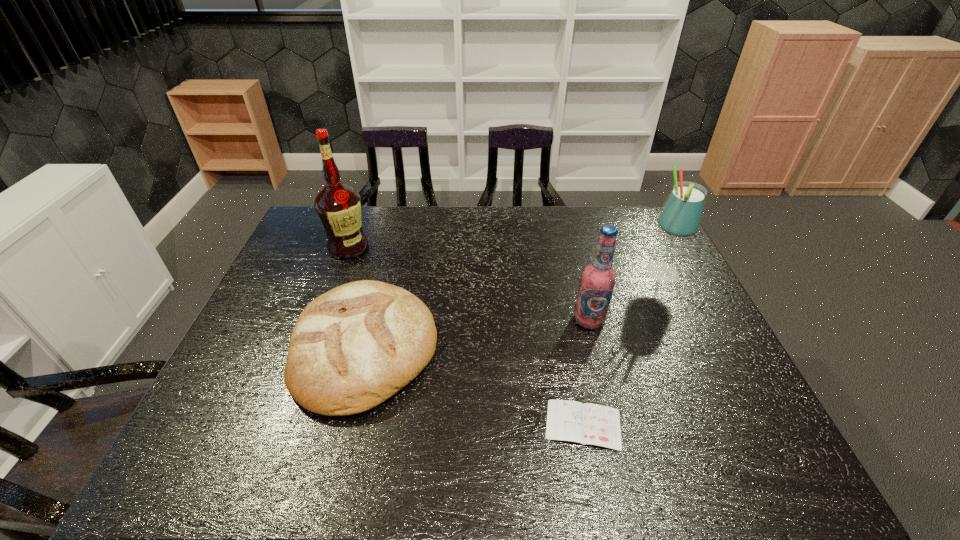
Identify the location of vacant space located 0.330m on the left of the shortest object. (396, 424).

Identify the location of object that is at the far edge. The width and height of the screenshot is (960, 540). (x=338, y=206).

Identify the location of object located in the near edge section of the desktop. This screenshot has height=540, width=960. (588, 424).

The width and height of the screenshot is (960, 540). What are the coordinates of `alcohol at the left edge` in the screenshot? It's located at (338, 206).

The width and height of the screenshot is (960, 540). Identify the location of bread that is at the left edge. (352, 348).

At what (x,y) coordinates should I click in order to perform the action: click on object present at the right edge. Please return your answer as a coordinate pair (x, y). This screenshot has width=960, height=540. Looking at the image, I should click on (681, 216).

Image resolution: width=960 pixels, height=540 pixels. What are the coordinates of `object that is at the far left corner` in the screenshot? It's located at (338, 206).

The height and width of the screenshot is (540, 960). I want to click on free space at the far edge of the desktop, so click(x=517, y=239).

This screenshot has width=960, height=540. In order to click on vacant space at the near edge of the desktop in this screenshot , I will do 500,451.

The image size is (960, 540). In the image, there is a desktop. What are the coordinates of `vacant space at the left edge` in the screenshot? It's located at (293, 274).